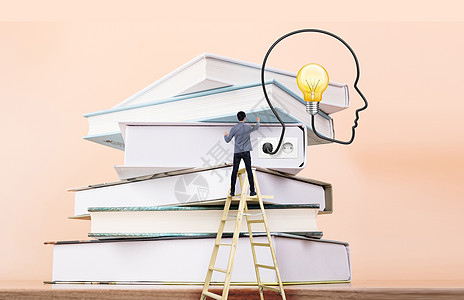
Find the location of a particular element. books is located at coordinates pyautogui.click(x=224, y=72), pyautogui.click(x=219, y=98), pyautogui.click(x=183, y=149), pyautogui.click(x=174, y=192), pyautogui.click(x=160, y=230), pyautogui.click(x=152, y=265).